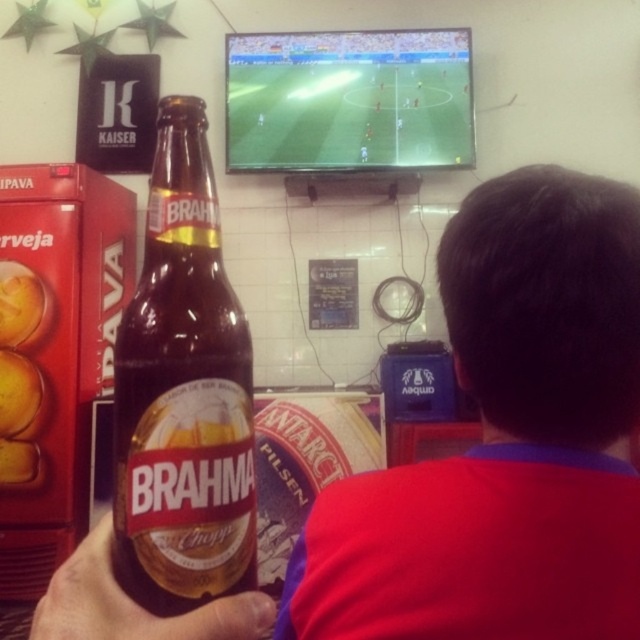
Who is more distant from viewer, (157, 465) or (257, 61)?

Point (257, 61)

This screenshot has height=640, width=640. In order to click on brown glass bottle at center in this screenshot , I will do `click(182, 392)`.

Does matte glass bottle at center appear under green screen soccer field at upper center?

Indeed, matte glass bottle at center is positioned under green screen soccer field at upper center.

What do you see at coordinates (504, 440) in the screenshot?
I see `matte glass bottle at center` at bounding box center [504, 440].

Who is more distant from viewer, (x=515, y=483) or (x=420, y=154)?

The point (x=420, y=154) is behind.

Where is `matte glass bottle at center`? The height and width of the screenshot is (640, 640). matte glass bottle at center is located at coordinates (504, 440).

Is matte glass bottle at center smaller than brown glass bottle at center?

Incorrect, matte glass bottle at center is not smaller in size than brown glass bottle at center.

In the scene shown: Does matte glass bottle at center have a greater width compared to brown glass bottle at center?

Yes, matte glass bottle at center is wider than brown glass bottle at center.

Find the location of a particular element. This screenshot has width=640, height=640. matte glass bottle at center is located at coordinates (504, 440).

Locate an element on the screen. This screenshot has width=640, height=640. matte glass bottle at center is located at coordinates (504, 440).